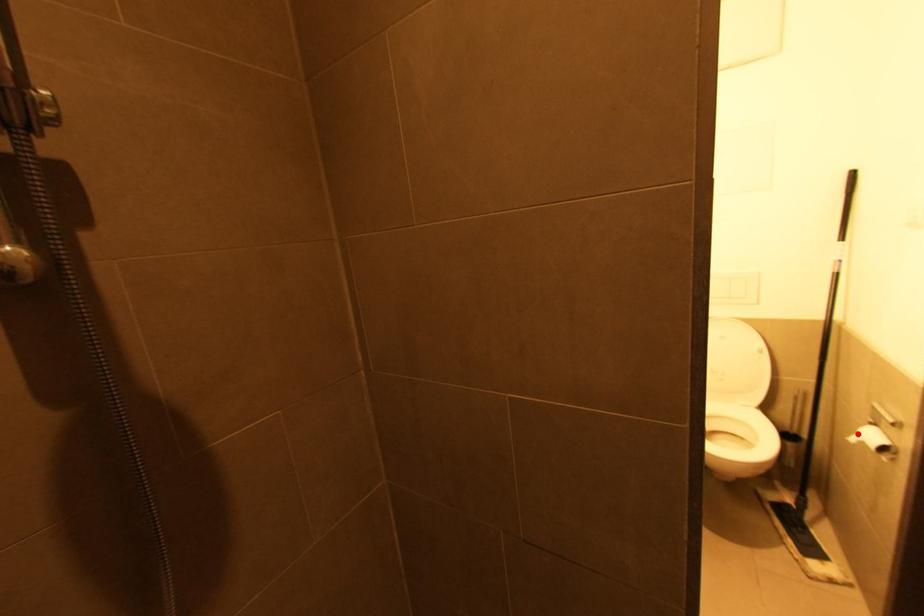
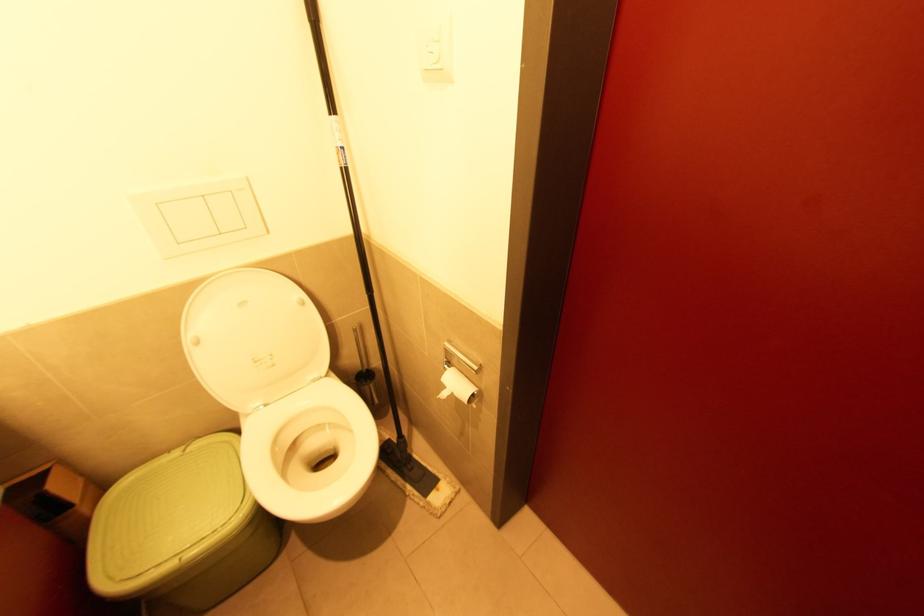
The point at the highlighted location is marked in the first image. Where is the corresponding point in the second image?

(444, 387)